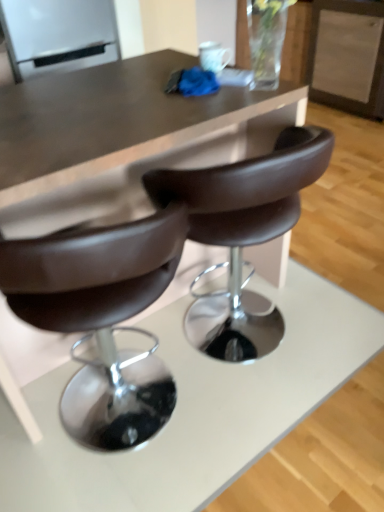
Identify the location of spots to the right of matte brown table at center. This screenshot has width=384, height=512. (334, 289).